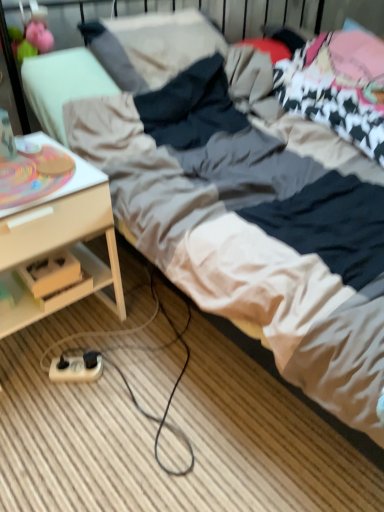
Find the location of `free space in front of beige plastic extension cord at lower left`. free space in front of beige plastic extension cord at lower left is located at coordinates (67, 421).